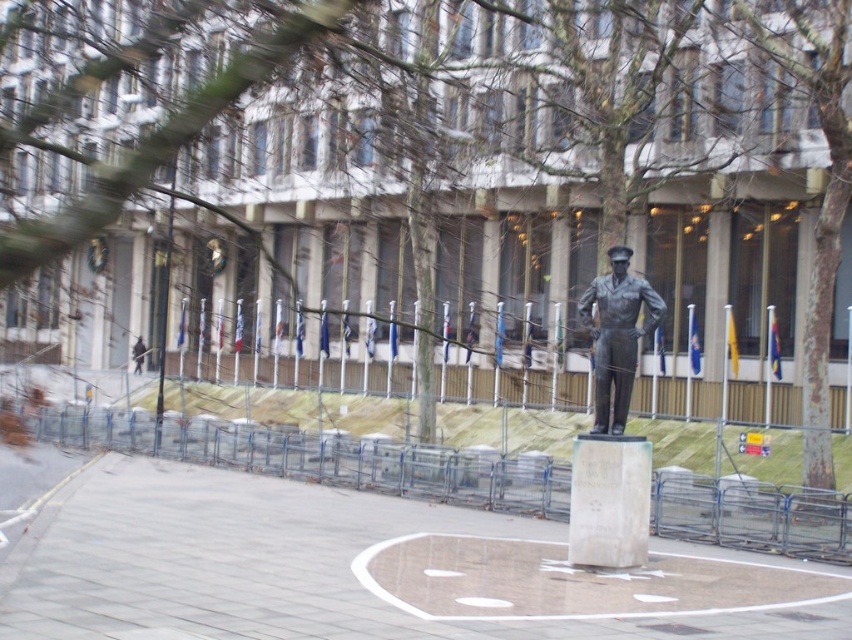
You are a city planner reviewing the layout of the urban space. You need to determine the order of objects from closest to farthest from the viewer. Which object is closer to the viewer between the white marble stone at center and the bronze statue at center?

The white marble stone at center is closer to the viewer than the bronze statue at center because it is positioned in front of it.

From the picture: You are taking a photo of the statue and the building in the background. You notice two points marked as point 1 at coordinates point (636, 493) and point 2 at coordinates point (619, 429). Which point is closer to your camera lens?

Point (636, 493) is closer to the camera than point (619, 429).

You are an urban planner reviewing a city layout. You see the white marble stone at center and the bronze statue at center in the image. Which object is positioned to the left of the other?

The white marble stone at center is to the left of the bronze statue at center.